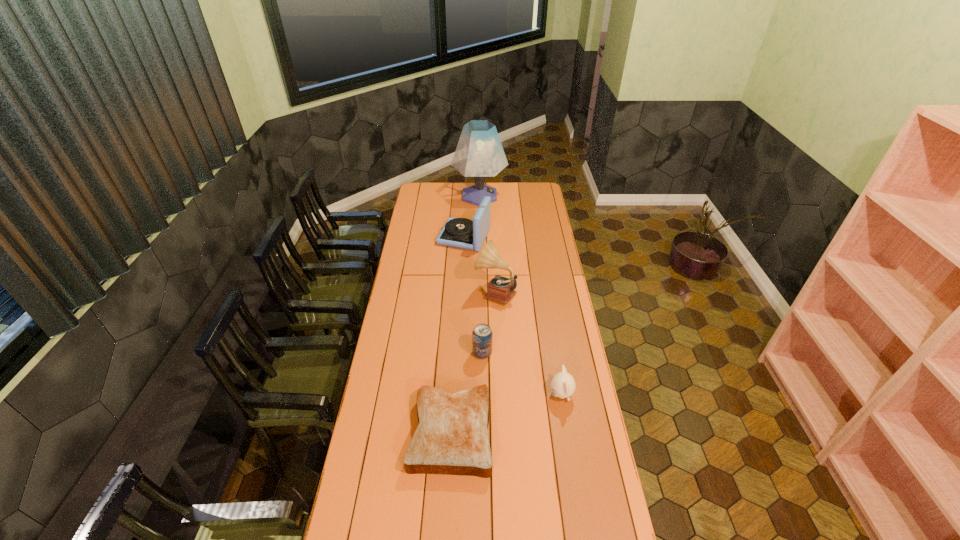
The height and width of the screenshot is (540, 960). I want to click on object present at the far edge, so (479, 153).

This screenshot has height=540, width=960. Identify the location of object that is at the right edge. (563, 385).

In the image, there is a desktop. In order to click on vacant region at the far edge in this screenshot , I will do `click(448, 194)`.

The image size is (960, 540). What are the coordinates of `vacant space at the left edge of the desktop` in the screenshot? It's located at (417, 203).

Identify the location of free space at the right edge of the desktop. Image resolution: width=960 pixels, height=540 pixels. (560, 284).

Locate an element on the screen. vacant point at the far right corner is located at coordinates (520, 183).

I want to click on vacant area that lies between the third tallest object and the bread, so click(x=458, y=335).

The height and width of the screenshot is (540, 960). Identify the location of free space between the tallest object and the third nearest object. (481, 274).

Where is `vacant space that's between the second farthest object and the shortest object`? The height and width of the screenshot is (540, 960). vacant space that's between the second farthest object and the shortest object is located at coordinates pyautogui.click(x=458, y=335).

The height and width of the screenshot is (540, 960). I want to click on free spot between the shortest object and the fourth shortest object, so [x=458, y=335].